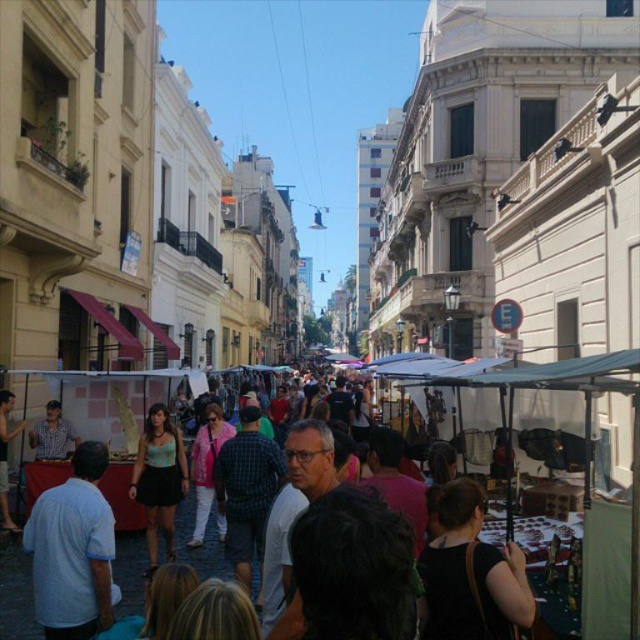
Question: Which point is closer to the camera taking this photo?

Choices:
 (A) (0, 420)
 (B) (154, 416)

Answer: (A)

Question: Which of these objects is positioned farthest from the matte black dress at center?

Choices:
 (A) matte black shirt at left
 (B) matte black shirt at center

Answer: (A)

Question: Which of the following is the closest to the observer?

Choices:
 (A) (1, 417)
 (B) (172, 536)
 (C) (40, 426)

Answer: (A)

Question: Does matte black dress at center have a smaller size compared to matte black shirt at center?

Choices:
 (A) yes
 (B) no

Answer: (B)

Question: Can you confirm if matte black dress at center is positioned below matte black shirt at center?

Choices:
 (A) no
 (B) yes

Answer: (B)

Question: Observing the image, what is the correct spatial positioning of matte black shirt at center in reference to matte black shirt at left?

Choices:
 (A) right
 (B) left

Answer: (A)